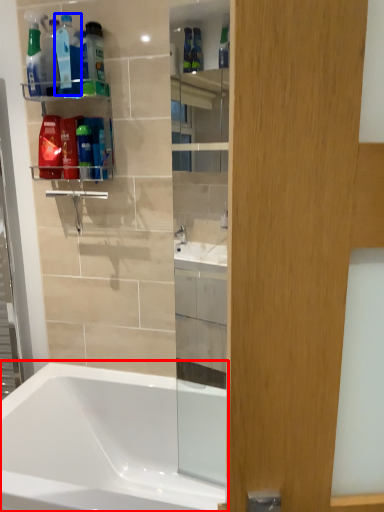
Question: Which object is further to the camera taking this photo, bathtub (highlighted by a red box) or cleaning product (highlighted by a blue box)?

Choices:
 (A) bathtub
 (B) cleaning product

Answer: (B)